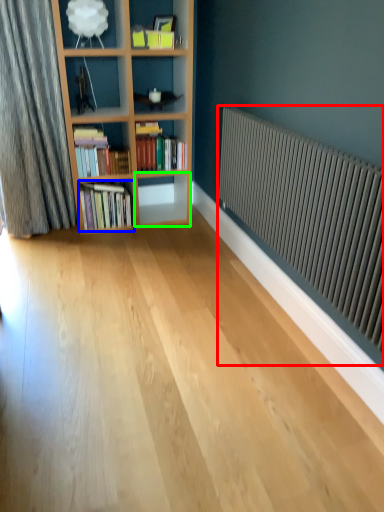
Question: Which object is the farthest from radiator (highlighted by a red box)? Choose among these: book (highlighted by a blue box) or shelf (highlighted by a green box).

Choices:
 (A) book
 (B) shelf

Answer: (B)